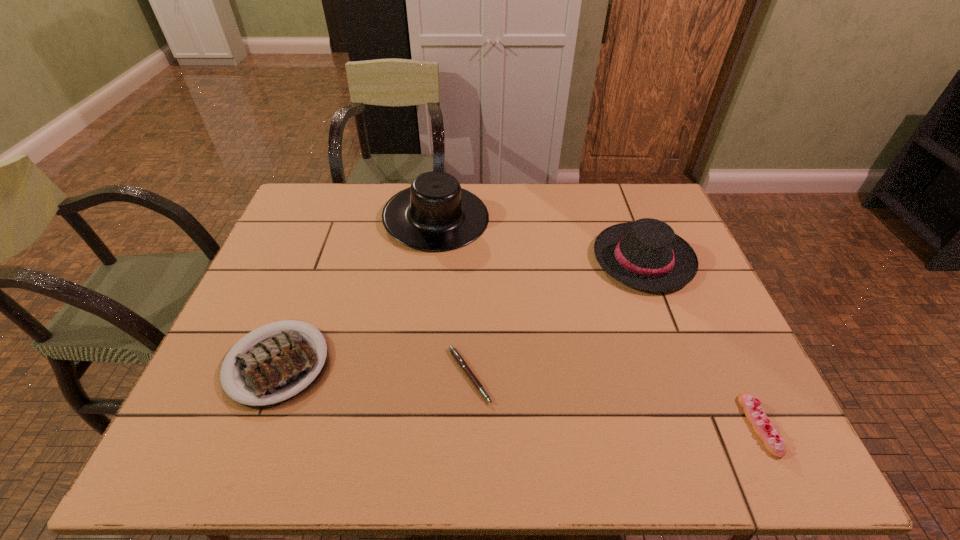
The height and width of the screenshot is (540, 960). I want to click on the taller dress hat, so click(435, 214).

Locate an element on the screen. The height and width of the screenshot is (540, 960). the left dress hat is located at coordinates (435, 214).

Where is `the second tallest object`? Image resolution: width=960 pixels, height=540 pixels. the second tallest object is located at coordinates (646, 254).

Image resolution: width=960 pixels, height=540 pixels. Find the location of `the right dress hat`. the right dress hat is located at coordinates (646, 254).

Identify the location of the leftmost object. (278, 365).

Locate an element on the screen. eclair is located at coordinates (755, 414).

Locate an element on the screen. pen is located at coordinates (457, 356).

Image resolution: width=960 pixels, height=540 pixels. In order to click on vacant space situated on the front of the left dress hat in this screenshot , I will do `click(425, 315)`.

At what (x,y) coordinates should I click in order to perform the action: click on free region located 0.190m on the front of the right dress hat. Please return your answer as a coordinate pair (x, y). The image size is (960, 540). Looking at the image, I should click on (680, 355).

In order to click on free region located 0.100m on the front of the leftmost object in this screenshot , I will do `click(238, 466)`.